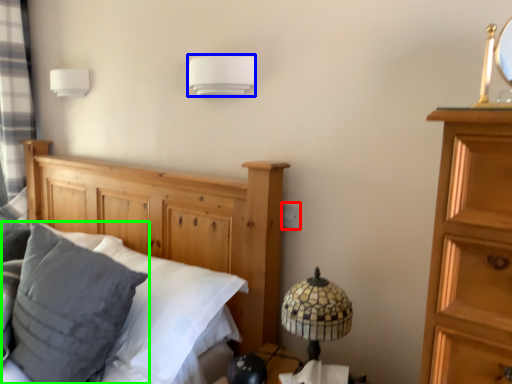
Question: Which object is the closest to the electric outlet (highlighted by a red box)? Choose among these: lamp (highlighted by a blue box) or pillow (highlighted by a green box).

Choices:
 (A) lamp
 (B) pillow

Answer: (A)